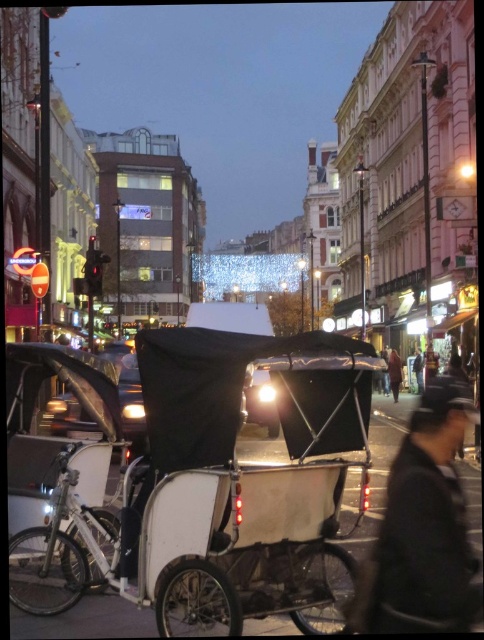
Question: Does white matte rickshaw at center appear on the right side of black matte coach at center?

Choices:
 (A) yes
 (B) no

Answer: (B)

Question: In this image, where is white matte rickshaw at center located relative to dark gray coat at center?

Choices:
 (A) left
 (B) right

Answer: (A)

Question: Which point is farther to the camera?

Choices:
 (A) dark gray coat at center
 (B) black matte coach at center
 (C) white matte rickshaw at center

Answer: (A)

Question: Among these objects, which one is farthest from the camera?

Choices:
 (A) dark gray coat at center
 (B) white matte rickshaw at center

Answer: (A)

Question: Does black matte coach at center have a greater width compared to dark gray coat at center?

Choices:
 (A) no
 (B) yes

Answer: (B)

Question: Which of the following is the farthest from the observer?

Choices:
 (A) (391, 518)
 (B) (331, 419)

Answer: (B)